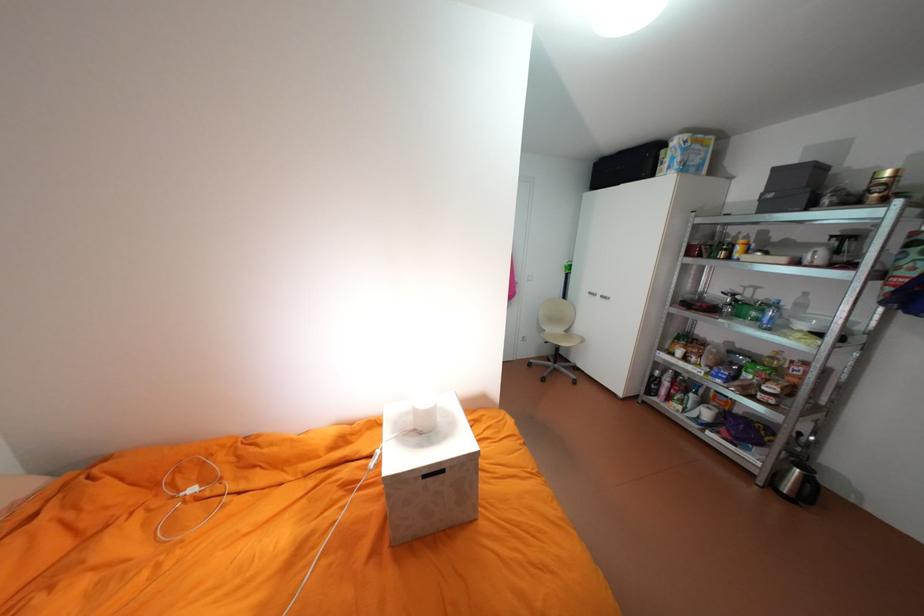
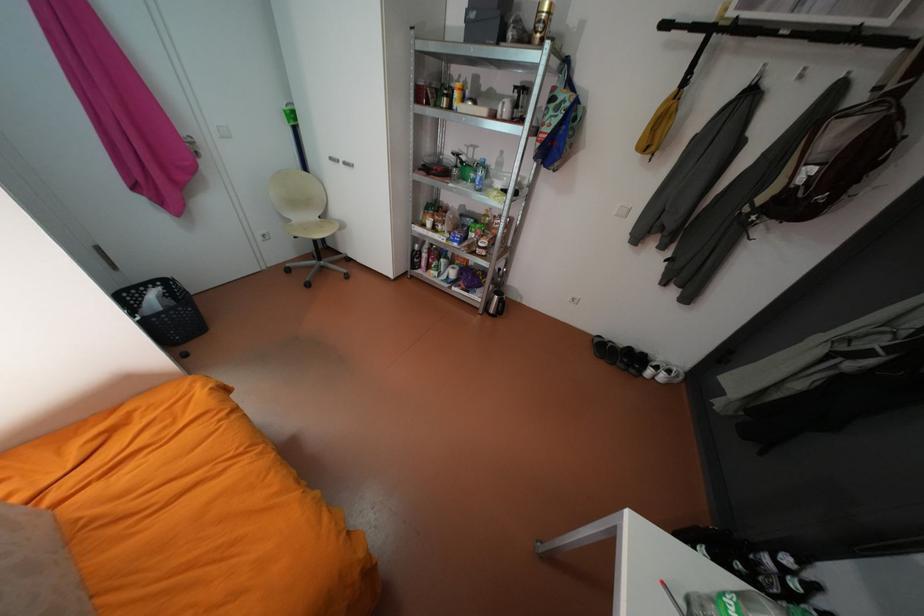
The point at (747, 314) is marked in the first image. Where is the corresponding point in the second image?

(471, 177)